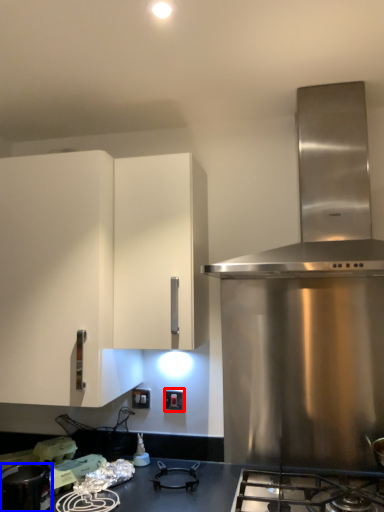
Question: Which of the following is the farthest to the observer, electric outlet (highlighted by a red box) or kitchen appliance (highlighted by a blue box)?

Choices:
 (A) electric outlet
 (B) kitchen appliance

Answer: (A)